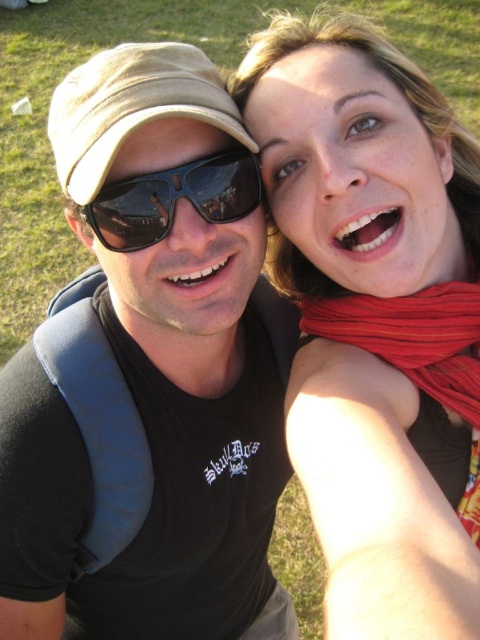
You are trying to decide which item to grab first from the scene shown. The black matte sunglasses at upper center and the red knitted scarf at upper right are both within reach. If you want to pick the wider item, which one should you choose?

The black matte sunglasses at upper center is wider than the red knitted scarf at upper right, so you should choose the black matte sunglasses at upper center.

You are a photographer trying to capture a candid shot of both the black matte sunglasses at upper center and the red knitted scarf at upper right in the same frame. Based on their positions, will the sunglasses be placed above or below the scarf in your photo?

The black matte sunglasses at upper center is below the red knitted scarf at upper right, so in the photo, the sunglasses will be positioned below the scarf.